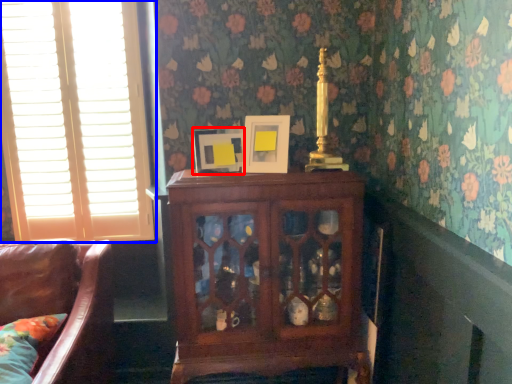
Question: Which point is closer to the camera, picture frame (highlighted by a red box) or window (highlighted by a blue box)?

Choices:
 (A) picture frame
 (B) window

Answer: (A)